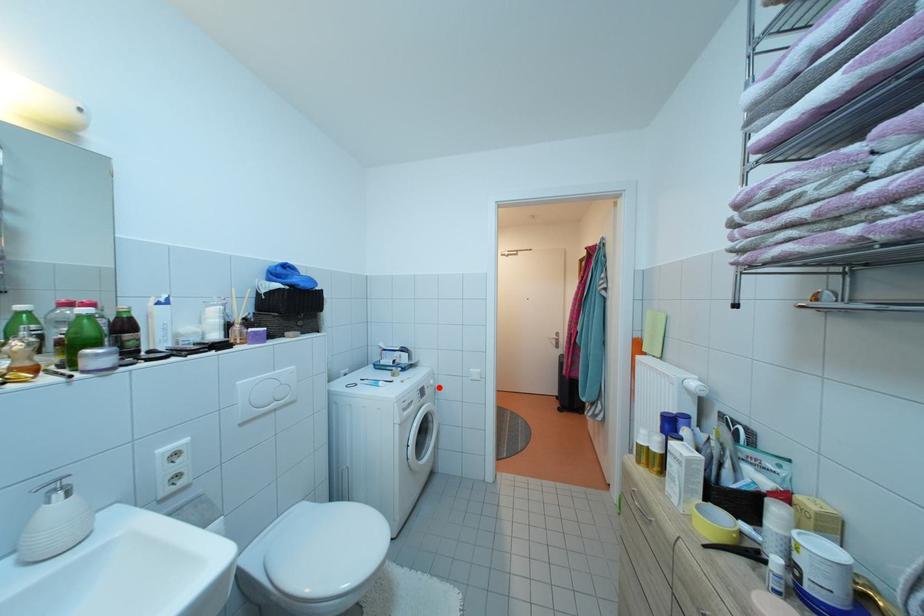
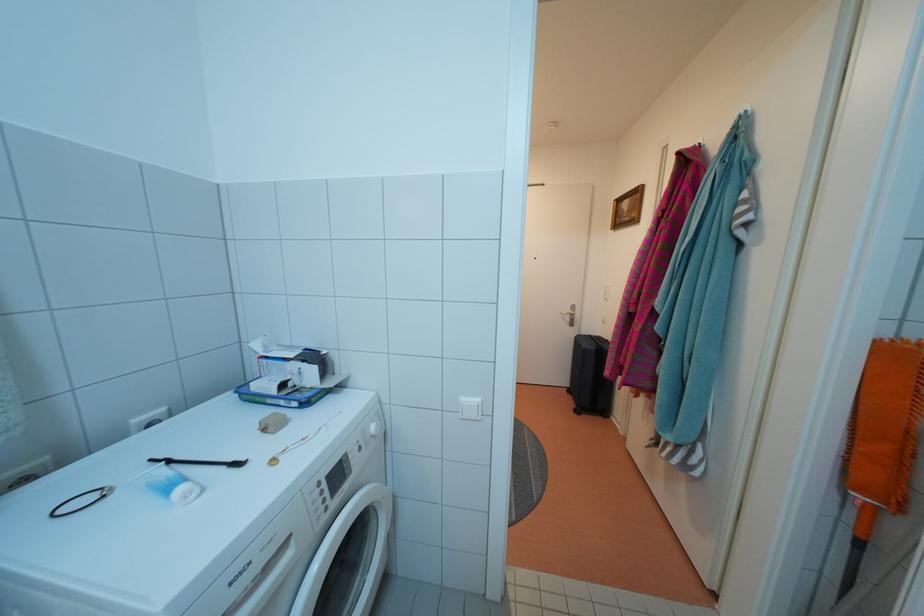
Find the pixel in the second image that matches the highlighted location in the first image.

(380, 434)